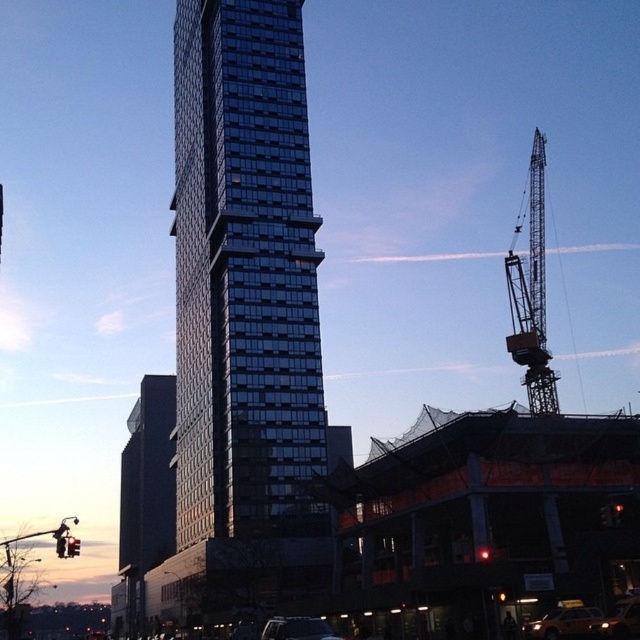
Can you confirm if metallic silver car at center is taller than red glass traffic light at left?

No, metallic silver car at center is not taller than red glass traffic light at left.

This screenshot has width=640, height=640. Describe the element at coordinates (298, 628) in the screenshot. I see `metallic silver car at center` at that location.

This screenshot has height=640, width=640. Describe the element at coordinates (298, 628) in the screenshot. I see `metallic silver car at center` at that location.

Locate an element on the screen. This screenshot has width=640, height=640. metallic silver car at center is located at coordinates (298, 628).

Who is positioned more to the right, shiny silver car at lower right or red glass traffic light at lower right?

Positioned to the right is shiny silver car at lower right.

Is point (605, 634) closer to viewer compared to point (620, 518)?

Yes.

The width and height of the screenshot is (640, 640). Identify the location of shiny silver car at lower right. pos(621,620).

Consider the image. Who is more distant from viewer, (x=308, y=618) or (x=484, y=557)?

Positioned behind is point (x=308, y=618).

Is metallic silver car at center further to the viewer compared to red glass traffic light at center?

No, metallic silver car at center is in front of red glass traffic light at center.

The width and height of the screenshot is (640, 640). In order to click on metallic silver car at center in this screenshot , I will do `click(298, 628)`.